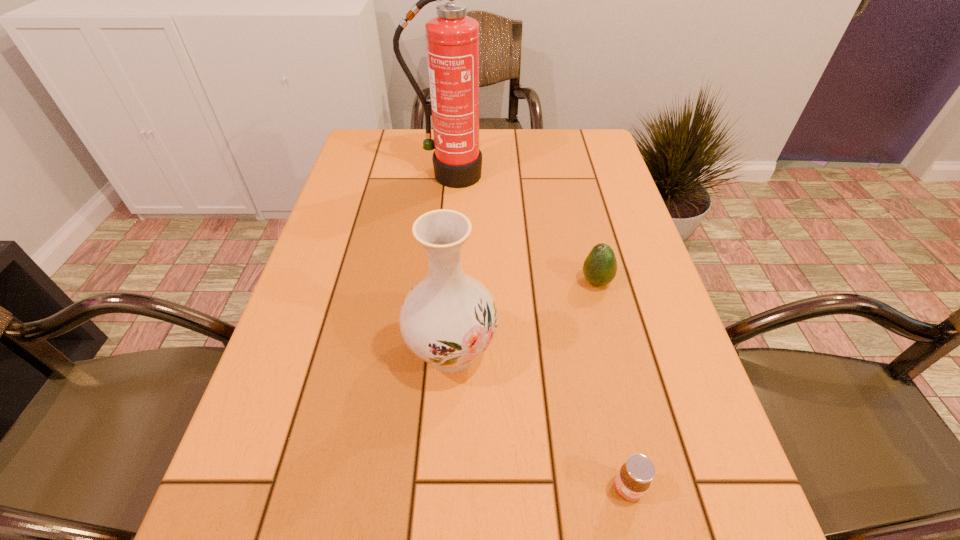
Where is `free area in between the third tallest object and the second nearest object`? The image size is (960, 540). free area in between the third tallest object and the second nearest object is located at coordinates (524, 317).

You are a GUI agent. You are given a task and a screenshot of the screen. Output one action in this format:
    pyautogui.click(x=<x>, y=<y>)
    Task: Click on the vacant space that is in between the fire extinguisher and the third nearest object
    
    Given the screenshot: What is the action you would take?
    pyautogui.click(x=523, y=228)

At what (x,y) coordinates should I click in order to perform the action: click on free area in between the third shortest object and the shortest object. Please return your answer as a coordinate pair (x, y). Looking at the image, I should click on (540, 420).

Where is `vacant space that's between the farthest object and the nearest object`? The image size is (960, 540). vacant space that's between the farthest object and the nearest object is located at coordinates (539, 332).

Locate an element on the screen. vacant point located between the tallest object and the nearest object is located at coordinates (539, 332).

Locate an element on the screen. unoccupied area between the third tallest object and the nearest object is located at coordinates (612, 385).

At what (x,y) coordinates should I click in order to perform the action: click on free space that is in between the farthest object and the nearest object. Please return your answer as a coordinate pair (x, y). This screenshot has width=960, height=540. Looking at the image, I should click on (539, 332).

What are the coordinates of `object identified as the closest to the vase` in the screenshot? It's located at (600, 267).

Choose which object is the nearest neighbor to the tallest object. Please provide its 2D coordinates. Your answer should be formatted as a tuple, i.e. [(x, y)], where the tuple contains the x and y coordinates of a point satisfying the conditions above.

[(600, 267)]

The image size is (960, 540). I want to click on vacant area in the image that satisfies the following two spatial constraints: 1. on the front-facing side of the fire extinguisher; 2. on the right side of the avocado, so click(x=440, y=282).